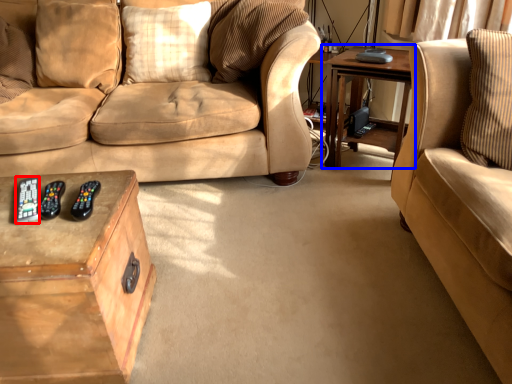
Question: Which object appears closest to the camera in this image, remote (highlighted by a red box) or table (highlighted by a blue box)?

Choices:
 (A) remote
 (B) table

Answer: (A)